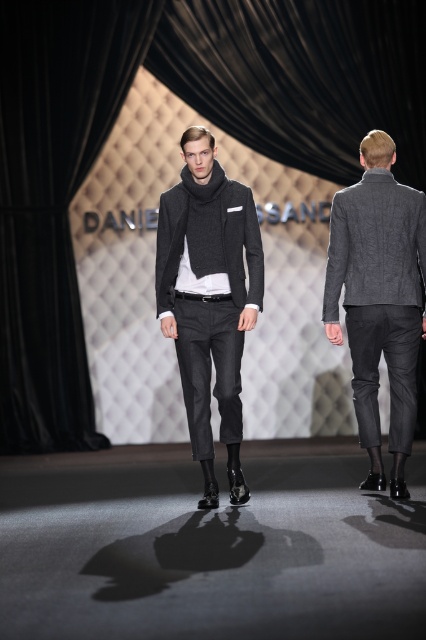
Based on the photo, you are a fashion designer observing the runway show. You notice the matte gray sweater at center and the textured gray blazer at right. Which item is positioned closer to the left side of the scene?

The matte gray sweater at center is positioned to the left of the textured gray blazer at right, making it closer to the left side of the scene.